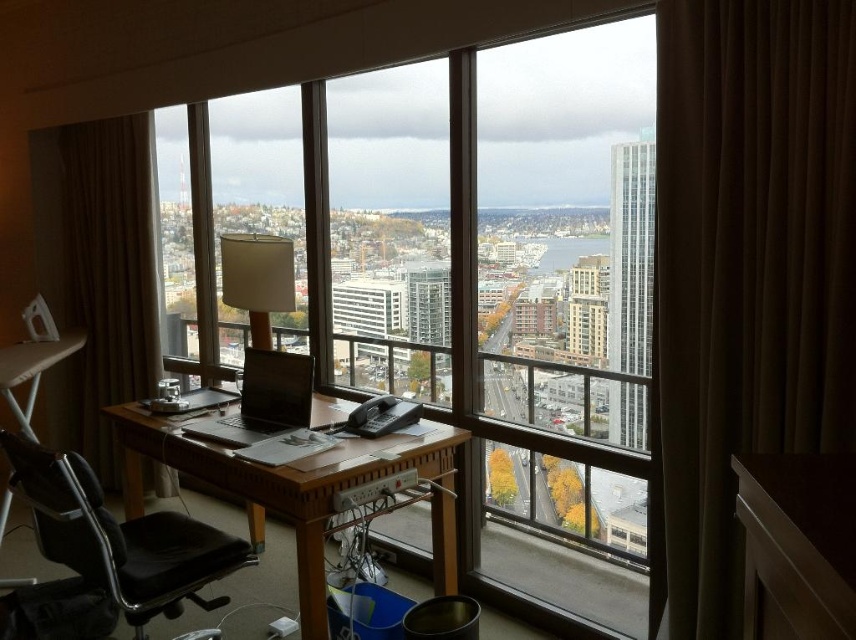
You are an office worker who needs to move your black leather swivel chair at left closer to the transparent glass window at center to enjoy the view. Considering the size difference between the two, can you estimate if there is enough space between them for the chair to move freely?

The transparent glass window at center is bigger than the black leather swivel chair at left. Since the window is larger, there should be sufficient space around it to allow the black leather swivel chair at left to move freely closer to it.

You are an office worker who needs to reach the transparent glass window at center to open it. You are currently sitting on the black leather swivel chair at left. Can you reach the window without leaving your seat?

The transparent glass window at center is 1.42 meters away from the black leather swivel chair at left. Since the distance is too far to reach manually while seated, you would need to get up to open it.

You are an office worker who needs to move from your current position to a meeting room located at the point labeled as point (254,317). There is an obstacle at point (248,556). Can you safely navigate around the obstacle to reach the meeting room?

Point (248,556) is in front of point (254,317), so the obstacle is blocking your path. You need to find an alternative route to reach the meeting room.